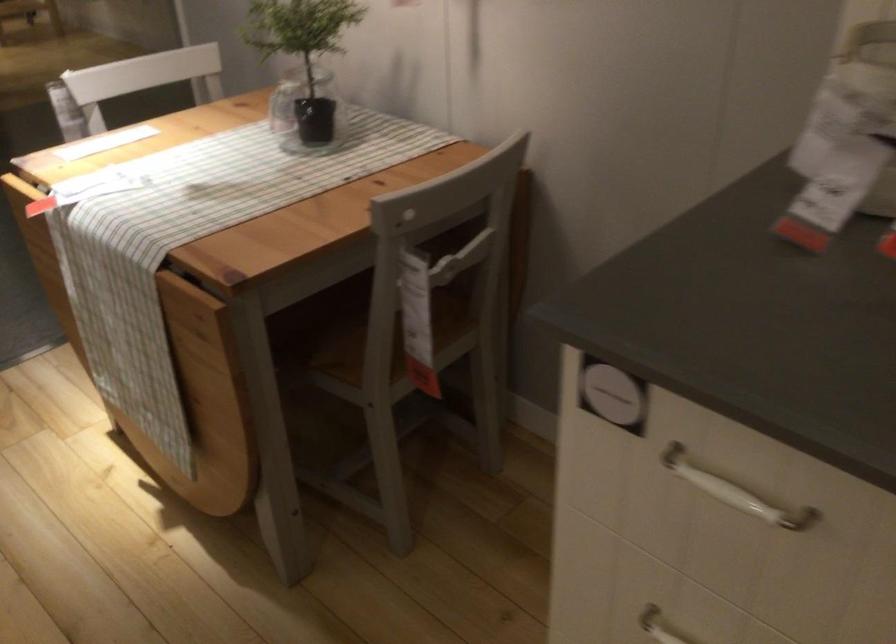
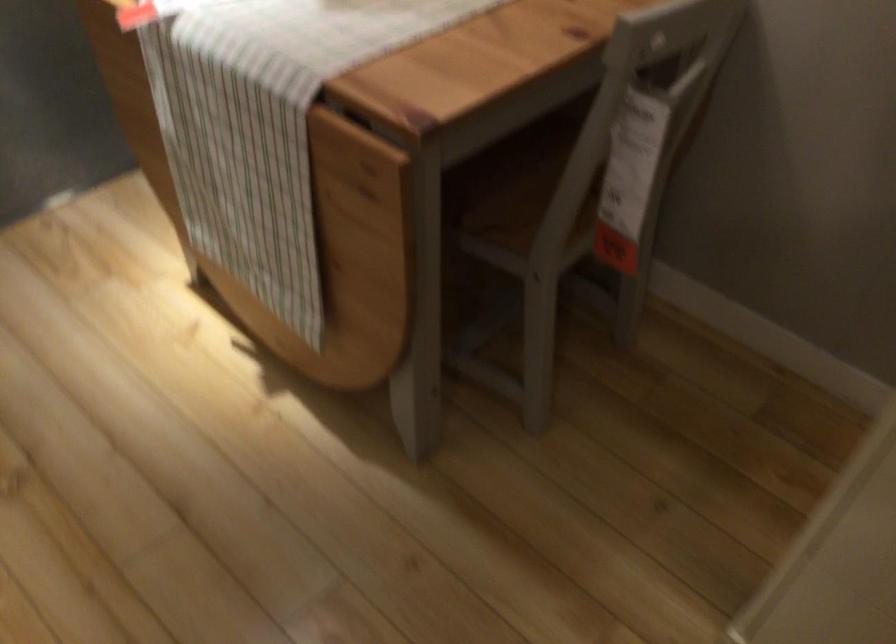
Question: The first image is from the beginning of the video and the second image is from the end. How did the camera likely rotate when shooting the video?

Choices:
 (A) Left
 (B) Right
 (C) Up
 (D) Down

Answer: (D)